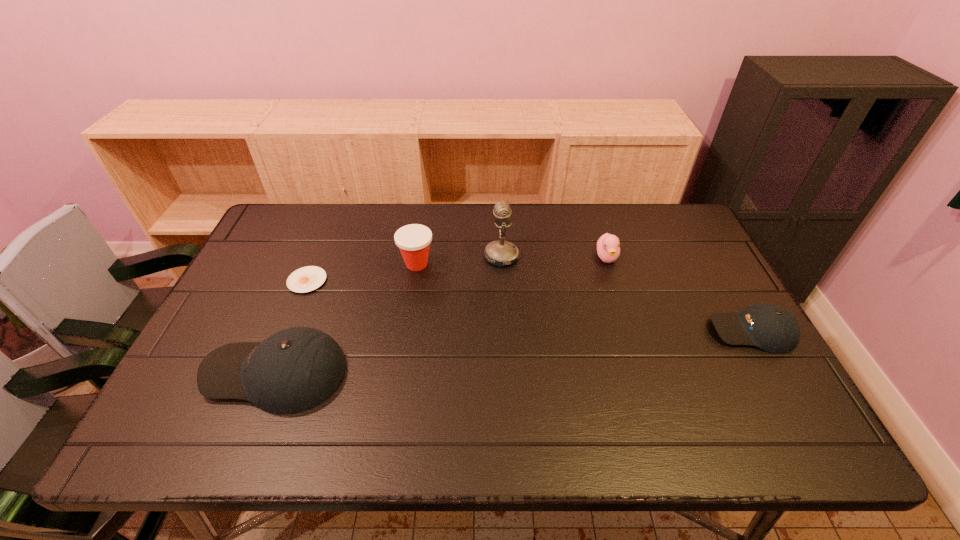
To make them evenly spaced by inserting another baseball_cap among them, please locate a vacant spot for this new baseball_cap. Please provide its 2D coordinates. Your answer should be formatted as a tuple, i.e. [(x, y)], where the tuple contains the x and y coordinates of a point satisfying the conditions above.

[(523, 351)]